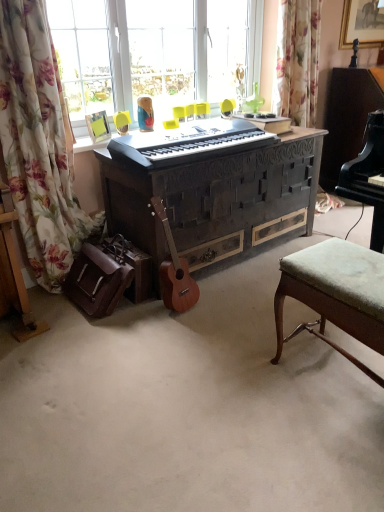
Question: From the image's perspective, does green fabric stool at lower right appear higher than yellow plastic swivel chair at center?

Choices:
 (A) no
 (B) yes

Answer: (A)

Question: From a real-world perspective, is green fabric stool at lower right physically above yellow plastic swivel chair at center?

Choices:
 (A) yes
 (B) no

Answer: (B)

Question: Is green fabric stool at lower right completely or partially outside of yellow plastic swivel chair at center?

Choices:
 (A) yes
 (B) no

Answer: (A)

Question: Considering the relative sizes of green fabric stool at lower right and yellow plastic swivel chair at center in the image provided, is green fabric stool at lower right smaller than yellow plastic swivel chair at center?

Choices:
 (A) yes
 (B) no

Answer: (B)

Question: From a real-world perspective, is green fabric stool at lower right under yellow plastic swivel chair at center?

Choices:
 (A) no
 (B) yes

Answer: (B)

Question: Looking at their shapes, would you say green fabric stool at lower right is wider or thinner than dark wood carved desk at center?

Choices:
 (A) thin
 (B) wide

Answer: (A)

Question: From a real-world perspective, is green fabric stool at lower right positioned above or below dark wood carved desk at center?

Choices:
 (A) below
 (B) above

Answer: (A)

Question: Based on their sizes in the image, would you say green fabric stool at lower right is bigger or smaller than dark wood carved desk at center?

Choices:
 (A) big
 (B) small

Answer: (B)

Question: From the image's perspective, is green fabric stool at lower right above or below dark wood carved desk at center?

Choices:
 (A) below
 (B) above

Answer: (A)

Question: Relative to green fabric stool at lower right, is wooden acoustic guitar at lower left in front or behind?

Choices:
 (A) behind
 (B) front

Answer: (A)

Question: Considering the positions of point (170, 240) and point (332, 303), is point (170, 240) closer or farther from the camera than point (332, 303)?

Choices:
 (A) farther
 (B) closer

Answer: (A)

Question: Is wooden acoustic guitar at lower left bigger or smaller than green fabric stool at lower right?

Choices:
 (A) big
 (B) small

Answer: (B)

Question: In the image, is wooden acoustic guitar at lower left on the left side or the right side of green fabric stool at lower right?

Choices:
 (A) right
 (B) left

Answer: (B)

Question: Choose the correct answer: Is matte black keyboard at center inside floral fabric curtain at left or outside it?

Choices:
 (A) inside
 (B) outside

Answer: (B)

Question: From a real-world perspective, relative to floral fabric curtain at left, is matte black keyboard at center vertically above or below?

Choices:
 (A) above
 (B) below

Answer: (A)